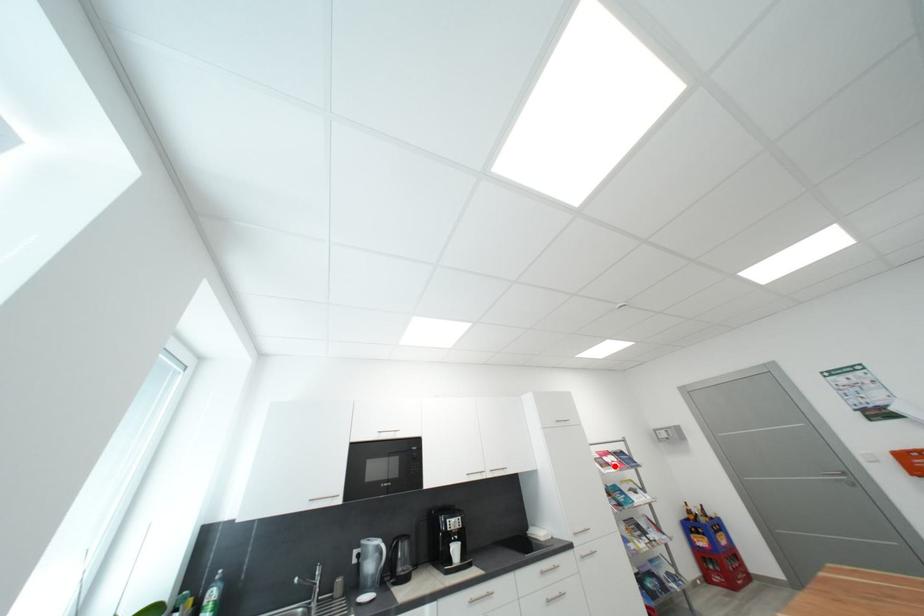
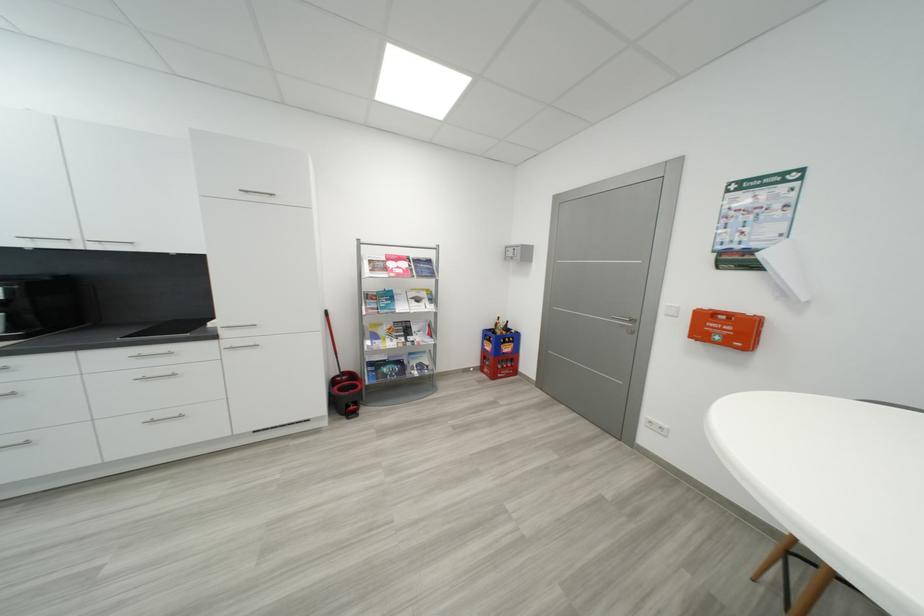
Find the pixel in the second image that matches the highlighted location in the first image.

(393, 270)